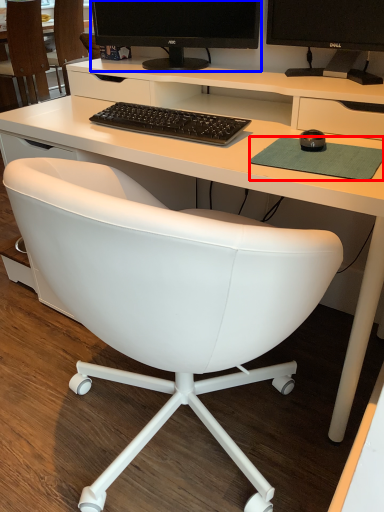
Question: Which point is further to the camera, mousepad (highlighted by a red box) or computer monitor (highlighted by a blue box)?

Choices:
 (A) mousepad
 (B) computer monitor

Answer: (B)